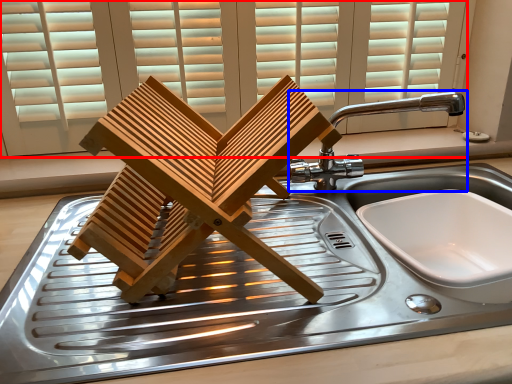
Question: Which of the following is the farthest to the observer, window (highlighted by a red box) or tap (highlighted by a blue box)?

Choices:
 (A) window
 (B) tap

Answer: (A)